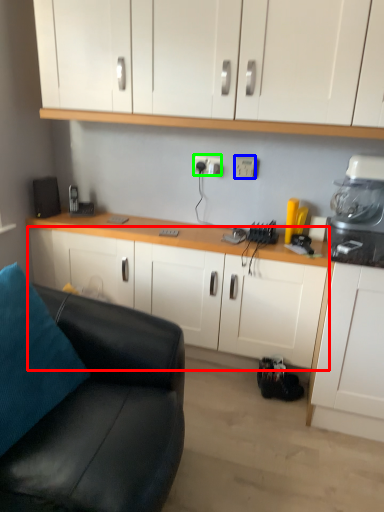
Question: Estimate the real-world distances between objects in this image. Which object is closer to cabinetry (highlighted by a red box), electric outlet (highlighted by a blue box) or electric outlet (highlighted by a green box)?

Choices:
 (A) electric outlet
 (B) electric outlet

Answer: (B)